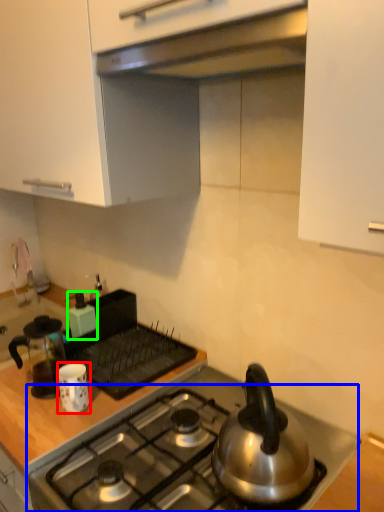
Question: Estimate the real-world distances between objects in this image. Which object is closer to kitchen appliance (highlighted by a red box), gas stove (highlighted by a blue box) or kitchen appliance (highlighted by a green box)?

Choices:
 (A) gas stove
 (B) kitchen appliance

Answer: (A)